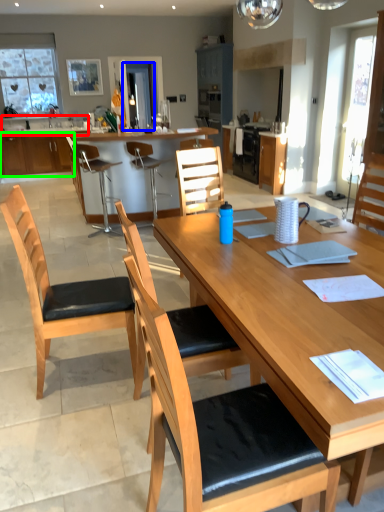
Question: Considering the real-world distances, which object is farthest from sink (highlighted by a red box)? glass door (highlighted by a blue box) or cabinetry (highlighted by a green box)?

Choices:
 (A) glass door
 (B) cabinetry

Answer: (A)